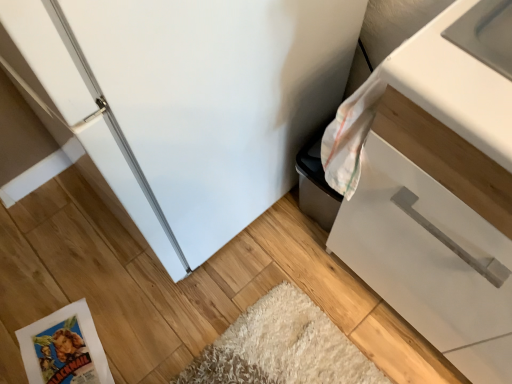
Question: Does white matte cabinet at right have a greater height compared to white paper comic book at lower left?

Choices:
 (A) no
 (B) yes

Answer: (B)

Question: Is white paper comic book at lower left located within white matte cabinet at right?

Choices:
 (A) yes
 (B) no

Answer: (B)

Question: From a real-world perspective, is white matte cabinet at right located beneath white paper comic book at lower left?

Choices:
 (A) no
 (B) yes

Answer: (A)

Question: Does white matte cabinet at right have a larger size compared to white paper comic book at lower left?

Choices:
 (A) no
 (B) yes

Answer: (B)

Question: Is white matte cabinet at right behind white paper comic book at lower left?

Choices:
 (A) yes
 (B) no

Answer: (B)

Question: Does white matte cabinet at right have a smaller size compared to white paper comic book at lower left?

Choices:
 (A) yes
 (B) no

Answer: (B)

Question: Considering the relative sizes of white paper comic book at lower left and white matte cabinet at right in the image provided, is white paper comic book at lower left smaller than white matte cabinet at right?

Choices:
 (A) no
 (B) yes

Answer: (B)

Question: From the image's perspective, is white paper comic book at lower left located beneath white matte cabinet at right?

Choices:
 (A) yes
 (B) no

Answer: (A)

Question: Is white matte cabinet at right at the back of white paper comic book at lower left?

Choices:
 (A) yes
 (B) no

Answer: (B)

Question: Can you confirm if white paper comic book at lower left is bigger than white matte cabinet at right?

Choices:
 (A) yes
 (B) no

Answer: (B)

Question: Can you confirm if white paper comic book at lower left is wider than white matte cabinet at right?

Choices:
 (A) no
 (B) yes

Answer: (A)

Question: Is white paper comic book at lower left taller than white matte cabinet at right?

Choices:
 (A) no
 (B) yes

Answer: (A)

Question: Considering the positions of white matte cabinet at right and white paper comic book at lower left in the image, is white matte cabinet at right taller or shorter than white paper comic book at lower left?

Choices:
 (A) tall
 (B) short

Answer: (A)